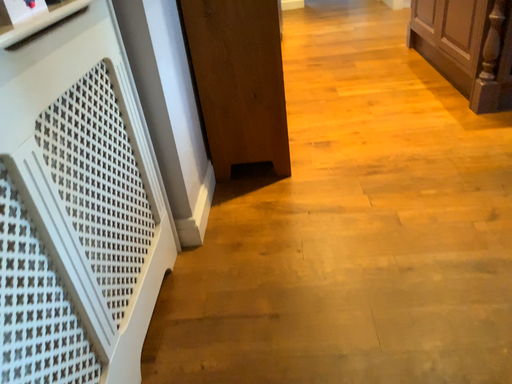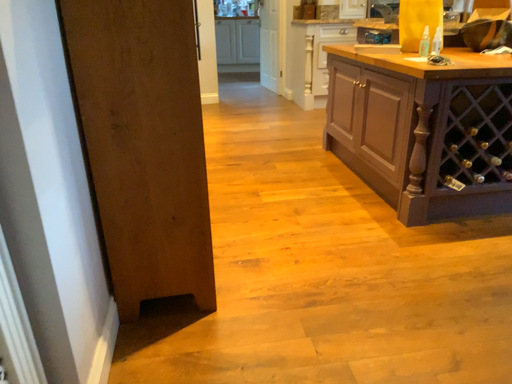
Question: How did the camera likely rotate when shooting the video?

Choices:
 (A) rotated right
 (B) rotated left

Answer: (A)